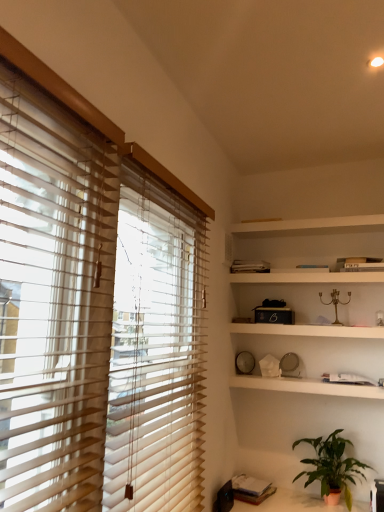
Question: Is green matte plant at lower right positioned beyond the bounds of white matte bookshelf at upper center, which is counted as the 2th shelf, starting from the top?

Choices:
 (A) no
 (B) yes

Answer: (B)

Question: From the image's perspective, is green matte plant at lower right under white matte bookshelf at upper center, acting as the 3th shelf starting from the bottom?

Choices:
 (A) no
 (B) yes

Answer: (B)

Question: Can you confirm if green matte plant at lower right is positioned to the right of white matte bookshelf at upper center, acting as the 3th shelf starting from the bottom?

Choices:
 (A) no
 (B) yes

Answer: (B)

Question: Considering the relative sizes of green matte plant at lower right and white matte bookshelf at upper center, which is counted as the 2th shelf, starting from the top, in the image provided, is green matte plant at lower right wider than white matte bookshelf at upper center, which is counted as the 2th shelf, starting from the top,?

Choices:
 (A) no
 (B) yes

Answer: (A)

Question: Considering the relative sizes of green matte plant at lower right and white matte bookshelf at upper center, which is counted as the 2th shelf, starting from the top, in the image provided, is green matte plant at lower right smaller than white matte bookshelf at upper center, which is counted as the 2th shelf, starting from the top,?

Choices:
 (A) yes
 (B) no

Answer: (B)

Question: Considering the positions of beige wood blinds at left and matte black book at lower right, which ranks as the second book in top-to-bottom order, in the image, is beige wood blinds at left bigger or smaller than matte black book at lower right, which ranks as the second book in top-to-bottom order,?

Choices:
 (A) big
 (B) small

Answer: (A)

Question: Does point (39, 370) appear closer or farther from the camera than point (248, 498)?

Choices:
 (A) closer
 (B) farther

Answer: (A)

Question: From the image's perspective, is beige wood blinds at left located above or below matte black book at lower right, which is the first book in bottom-to-top order?

Choices:
 (A) above
 (B) below

Answer: (A)

Question: In the image, is beige wood blinds at left on the left side or the right side of matte black book at lower right, which is the first book in bottom-to-top order?

Choices:
 (A) right
 (B) left

Answer: (B)

Question: Is white wooden shelf at upper center, positioned as the 1th shelf in top-to-bottom order, in front of or behind beige wood blinds at left in the image?

Choices:
 (A) behind
 (B) front

Answer: (A)

Question: Is white wooden shelf at upper center, positioned as the 1th shelf in top-to-bottom order, to the left or to the right of beige wood blinds at left in the image?

Choices:
 (A) left
 (B) right

Answer: (B)

Question: From a real-world perspective, is white wooden shelf at upper center, marked as the fourth shelf in a bottom-to-top arrangement, positioned above or below beige wood blinds at left?

Choices:
 (A) below
 (B) above

Answer: (B)

Question: Choose the correct answer: Is white wooden shelf at upper center, positioned as the 1th shelf in top-to-bottom order, inside beige wood blinds at left or outside it?

Choices:
 (A) outside
 (B) inside

Answer: (A)

Question: Is white matte book at upper center, positioned as the first book in back-to-front order, spatially inside white matte clock at center, the 4th shelf viewed from the top, or outside of it?

Choices:
 (A) inside
 (B) outside

Answer: (B)

Question: In terms of width, does white matte book at upper center, the 2th book from the bottom, look wider or thinner when compared to white matte clock at center, the 4th shelf viewed from the top?

Choices:
 (A) thin
 (B) wide

Answer: (A)